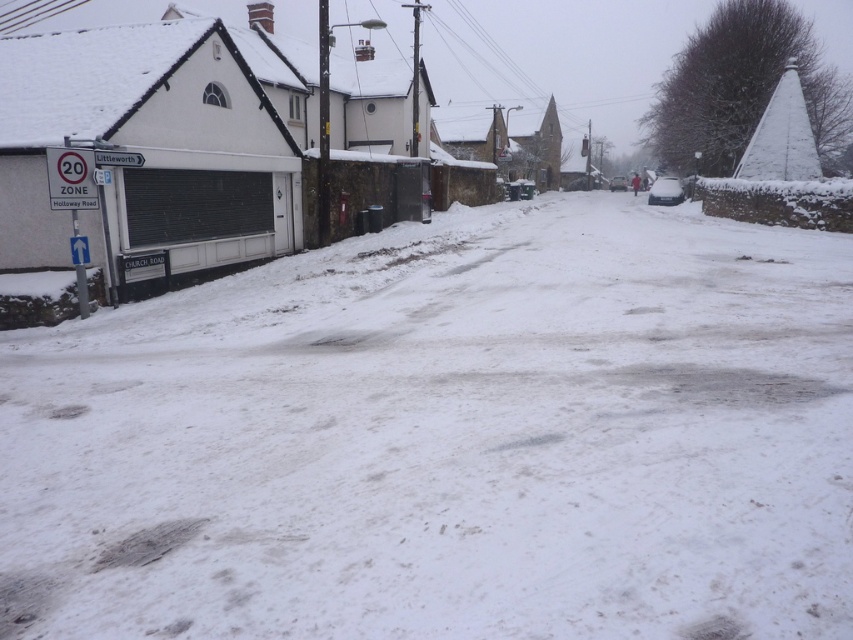
Question: Among these points, which one is nearest to the camera?

Choices:
 (A) (664, 177)
 (B) (611, 186)
 (C) (660, 451)
 (D) (102, 556)

Answer: (D)

Question: Does gray snow at lower center have a smaller size compared to matte black car at center?

Choices:
 (A) no
 (B) yes

Answer: (B)

Question: Is snow-covered car at center to the right of matte black car at center from the viewer's perspective?

Choices:
 (A) no
 (B) yes

Answer: (A)

Question: Which point is farther to the camera?

Choices:
 (A) (614, 188)
 (B) (3, 627)

Answer: (A)

Question: Is gray snow at lower center positioned behind matte black car at center?

Choices:
 (A) no
 (B) yes

Answer: (A)

Question: Which of the following is the farthest from the observer?

Choices:
 (A) snow-covered car at center
 (B) matte black car at center
 (C) gray snow at lower center
 (D) white powdery snow at lower left

Answer: (B)